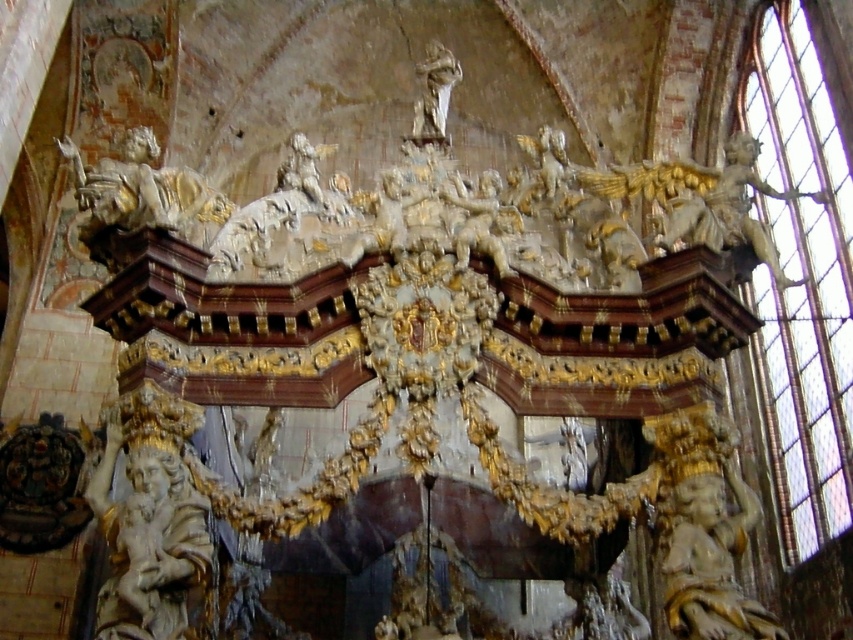
Question: Can you confirm if polished stone cherub at left is positioned below white marble cherub at center?

Choices:
 (A) yes
 (B) no

Answer: (A)

Question: Estimate the real-world distances between objects in this image. Which object is closer to the gold leaf statue at right?

Choices:
 (A) polished stone cherub at left
 (B) gold leaf statue at upper left
 (C) white marble cherub at upper center

Answer: (C)

Question: Is gold leaf statue at upper left closer to the viewer compared to white marble cherub at upper center?

Choices:
 (A) yes
 (B) no

Answer: (A)

Question: Estimate the real-world distances between objects in this image. Which object is farther from the white marble cherub at upper center?

Choices:
 (A) polished stone cherub at left
 (B) gold leaf statue at upper left

Answer: (A)

Question: Is gold leaf statue at right bigger than white marble cherub at upper center?

Choices:
 (A) yes
 (B) no

Answer: (A)

Question: Which point is farther to the camera?

Choices:
 (A) (688, 506)
 (B) (178, 198)

Answer: (B)